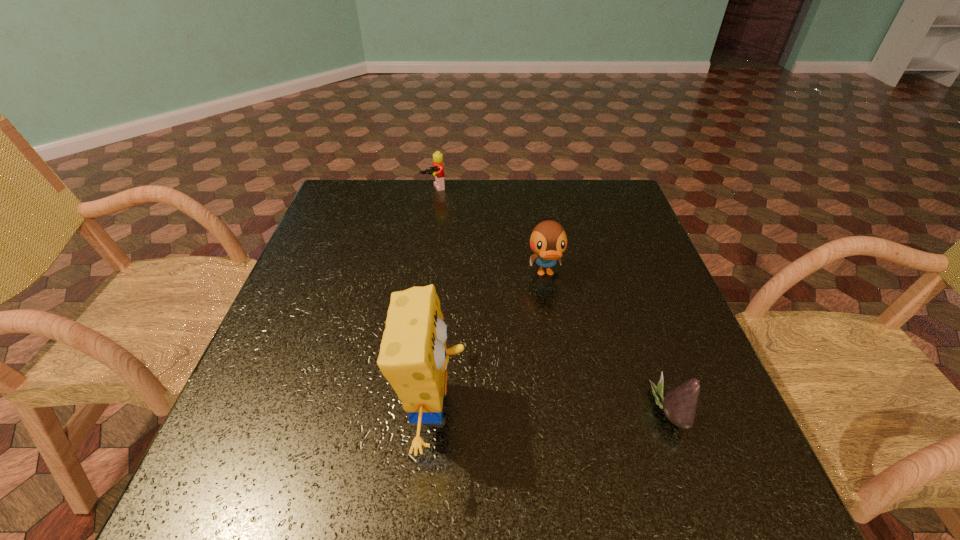
Where is `sponge`? sponge is located at coordinates 413,357.

This screenshot has width=960, height=540. I want to click on avocado, so click(x=679, y=404).

Where is `the second tallest object`? The height and width of the screenshot is (540, 960). the second tallest object is located at coordinates (548, 241).

The height and width of the screenshot is (540, 960). I want to click on duck, so tap(548, 241).

At what (x,y) coordinates should I click in order to perform the action: click on the farthest object. Please return your answer as a coordinate pair (x, y). Looking at the image, I should click on (437, 171).

Locate an element on the screen. This screenshot has width=960, height=540. vacant space located 0.070m on the face of the sponge is located at coordinates (505, 409).

Find the location of `vacant space positioned on the seed side of the rightmost object`. vacant space positioned on the seed side of the rightmost object is located at coordinates pos(730,410).

I want to click on free region located 0.070m on the front-facing side of the third nearest object, so click(x=553, y=310).

This screenshot has width=960, height=540. What are the coordinates of `free space located on the front-facing side of the third nearest object` in the screenshot? It's located at (x=553, y=310).

Locate an element on the screen. This screenshot has height=540, width=960. free region located on the front-facing side of the third nearest object is located at coordinates (555, 320).